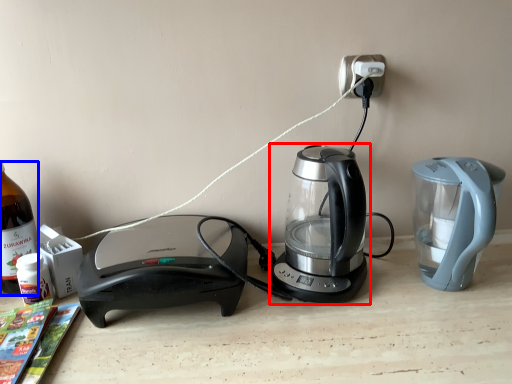
Question: Which object is closer to the camera taking this photo, kettle (highlighted by a red box) or bottle (highlighted by a blue box)?

Choices:
 (A) kettle
 (B) bottle

Answer: (A)